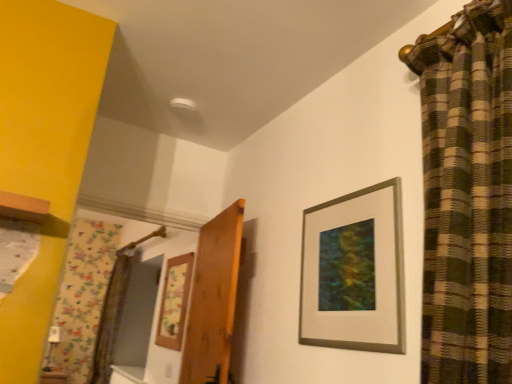
Question: Which direction should I rotate to face wooden picture frame at center, which is the second picture frame from right to left, — up or down?

Choices:
 (A) down
 (B) up

Answer: (A)

Question: From a real-world perspective, does wooden door at center stand above wooden picture frame at center, acting as the first picture frame starting from the back?

Choices:
 (A) yes
 (B) no

Answer: (B)

Question: Can wooden picture frame at center, which is counted as the 1th picture frame, starting from the bottom, be found inside wooden door at center?

Choices:
 (A) yes
 (B) no

Answer: (B)

Question: From a real-world perspective, is wooden door at center under wooden picture frame at center, placed as the first picture frame when sorted from left to right?

Choices:
 (A) no
 (B) yes

Answer: (B)

Question: Is wooden door at center to the left of wooden picture frame at center, which is the second picture frame from right to left, from the viewer's perspective?

Choices:
 (A) no
 (B) yes

Answer: (A)

Question: Is wooden door at center shorter than wooden picture frame at center, acting as the first picture frame starting from the back?

Choices:
 (A) yes
 (B) no

Answer: (B)

Question: Is wooden door at center to the right of wooden picture frame at center, which is counted as the 1th picture frame, starting from the bottom, from the viewer's perspective?

Choices:
 (A) no
 (B) yes

Answer: (B)

Question: Considering the relative positions of wooden picture frame at center, which is counted as the 1th picture frame, starting from the bottom, and wooden door at center in the image provided, is wooden picture frame at center, which is counted as the 1th picture frame, starting from the bottom, behind wooden door at center?

Choices:
 (A) no
 (B) yes

Answer: (B)

Question: Is wooden picture frame at center, the second picture frame in the front-to-back sequence, thinner than wooden door at center?

Choices:
 (A) no
 (B) yes

Answer: (B)

Question: Could wooden door at center be considered to be inside wooden picture frame at center, acting as the first picture frame starting from the back?

Choices:
 (A) no
 (B) yes

Answer: (A)

Question: Are wooden picture frame at center, acting as the first picture frame starting from the back, and wooden door at center beside each other?

Choices:
 (A) yes
 (B) no

Answer: (B)

Question: From a real-world perspective, is wooden picture frame at center, the second picture frame in the front-to-back sequence, on wooden door at center?

Choices:
 (A) no
 (B) yes

Answer: (B)

Question: Is wooden picture frame at center, acting as the first picture frame starting from the back, directly adjacent to silver/metallic picture frame at upper right, placed as the 1th picture frame when sorted from top to bottom?

Choices:
 (A) no
 (B) yes

Answer: (A)